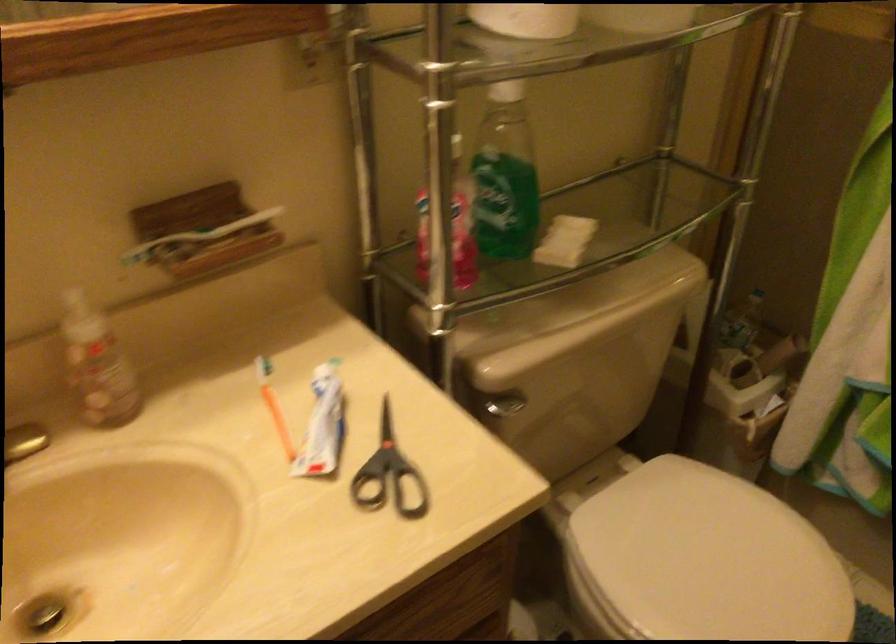
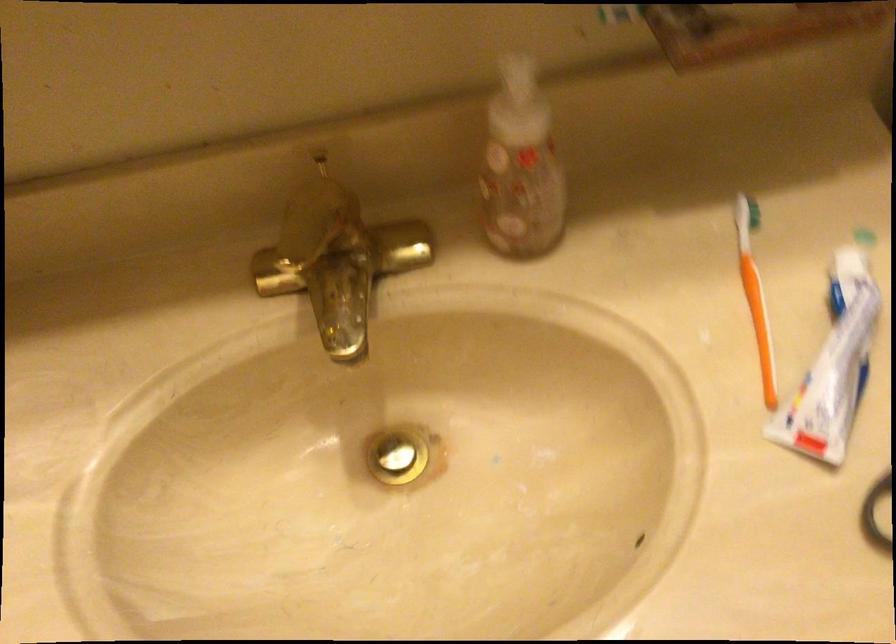
In the second image, find the point that corresponds to pixel 92 355 in the first image.

(521, 167)